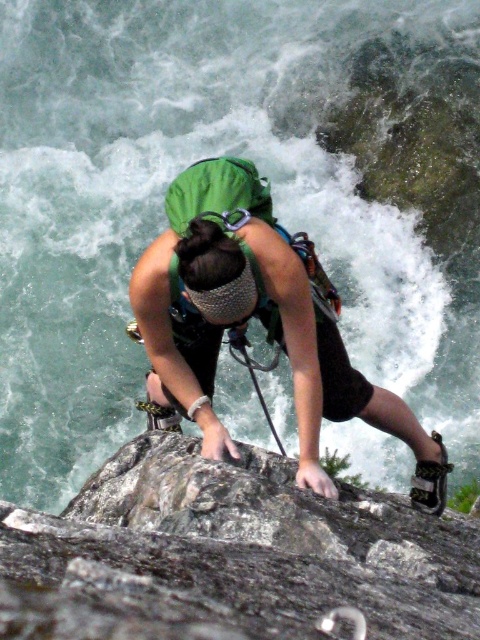
You are a climber assessing the safety of your gear. You have a gray rough rock at center and a green fabric helmet at center in your view. Which object is wider?

The gray rough rock at center is wider than the green fabric helmet at center.

You are a rock climber preparing to ascend a rocky outcrop. You notice the gray rough rock at center and the green fabric helmet at center. Which object is closer to the ground?

The gray rough rock at center is shorter than the green fabric helmet at center, so the gray rough rock at center is closer to the ground.